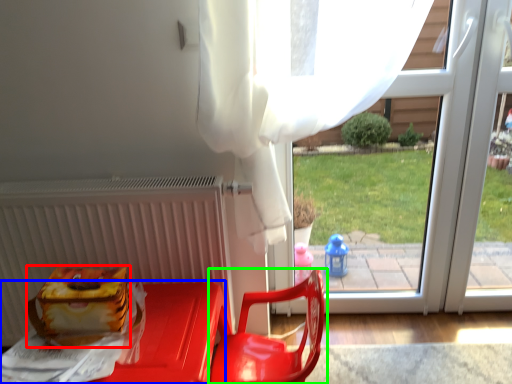
Question: Which object is the farthest from lunch box (highlighted by a red box)? Choose among these: furniture (highlighted by a blue box) or chair (highlighted by a green box).

Choices:
 (A) furniture
 (B) chair

Answer: (B)